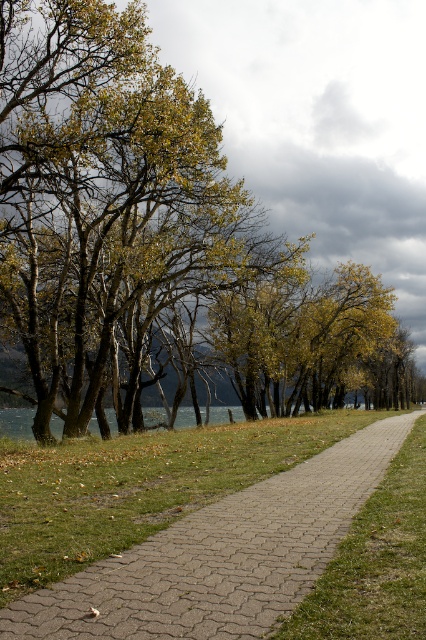
Is green leafy tree at center taller than pebble gray pavement at center?

Correct, green leafy tree at center is much taller as pebble gray pavement at center.

Between green leafy tree at center and pebble gray pavement at center, which one is positioned higher?

green leafy tree at center is higher up.

Which is in front, point (261, 344) or point (178, 611)?

Positioned in front is point (178, 611).

Find the location of a particular element. This screenshot has width=426, height=640. green leafy tree at center is located at coordinates (146, 228).